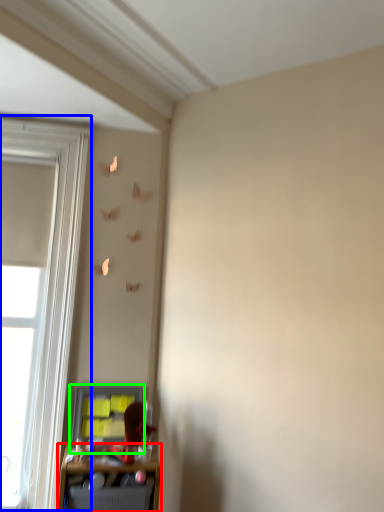
Question: Estimate the real-world distances between objects in this image. Which object is farther from shelf (highlighted by a red box), window (highlighted by a blue box) or cabinet (highlighted by a green box)?

Choices:
 (A) window
 (B) cabinet

Answer: (A)